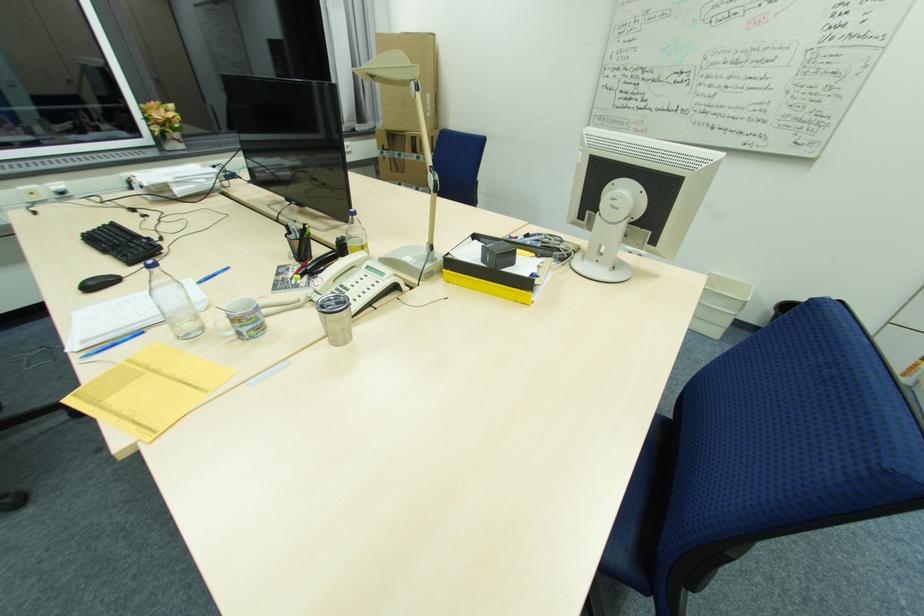
Which object does [132,334] point to?

It corresponds to the blue pen in the image.